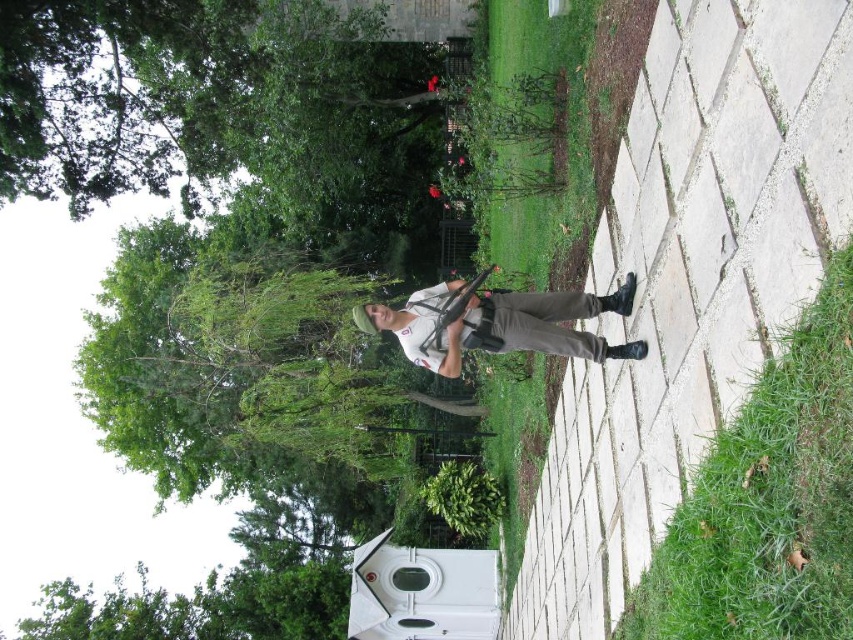
Does point (582, 240) come closer to viewer compared to point (561, 308)?

No, (582, 240) is further to viewer.

Between green grass at center and matte white shirt at center, which one is positioned lower?

matte white shirt at center

This screenshot has width=853, height=640. What are the coordinates of `green grass at center` in the screenshot? It's located at (534, 141).

Image resolution: width=853 pixels, height=640 pixels. I want to click on green grass at lower right, so click(x=769, y=500).

Who is more distant from viewer, (772,600) or (579,170)?

Point (579,170)

Is point (840, 256) farther from viewer compared to point (531, 246)?

No, it is in front of (531, 246).

You are a GUI agent. You are given a task and a screenshot of the screen. Output one action in this format:
    pyautogui.click(x=<x>, y=<y>)
    Task: Click on the green grass at lower right
    
    Given the screenshot: What is the action you would take?
    pyautogui.click(x=769, y=500)

Locate an element on the screen. The image size is (853, 640). green grass at lower right is located at coordinates (769, 500).

Is green grass at lower right smaller than matte white shirt at center?

Indeed, green grass at lower right has a smaller size compared to matte white shirt at center.

Is point (780, 397) positioned after point (527, 348)?

No, (780, 397) is in front of (527, 348).

Find the location of a particular element. This screenshot has height=640, width=853. green grass at lower right is located at coordinates (769, 500).